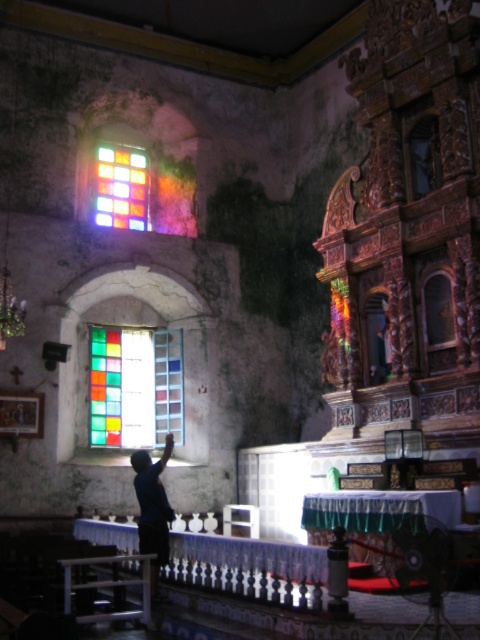
Consider the image. You are standing in the historic church and notice a stained glass window at center and a dark blue shirt at center. Which object is positioned to the left?

The stained glass window at center is to the left of the dark blue shirt at center.

You are standing in the historic church and notice the stained glass window at upper left and the dark blue shirt at center. Which object is positioned higher in the image?

The stained glass window at upper left is located above the dark blue shirt at center, so it is positioned higher.